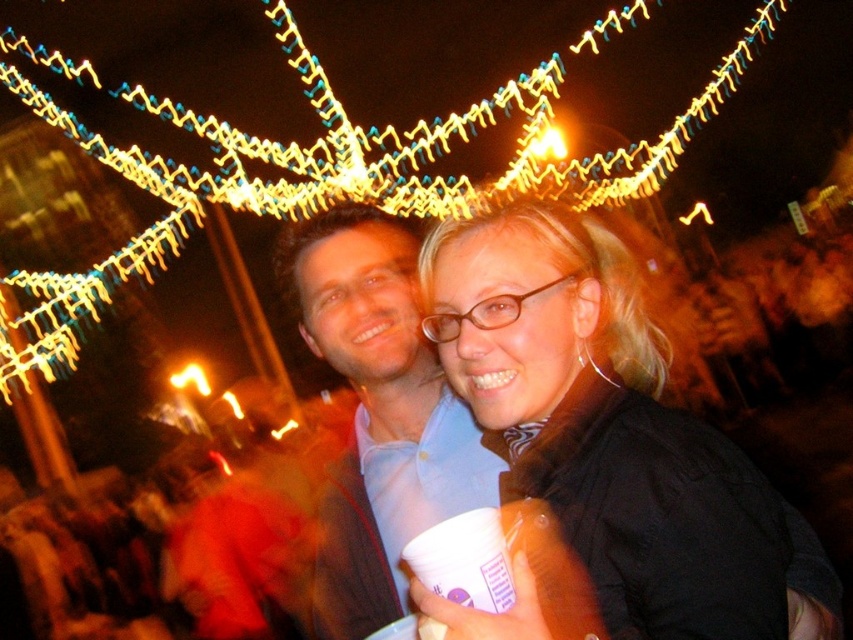
Between black matte jacket at center and yellow string lights at upper center, which one is positioned lower?

Positioned lower is black matte jacket at center.

Who is taller, black matte jacket at center or yellow string lights at upper center?

Standing taller between the two is yellow string lights at upper center.

You are a GUI agent. You are given a task and a screenshot of the screen. Output one action in this format:
    pyautogui.click(x=<x>, y=<y>)
    Task: Click on the black matte jacket at center
    The height and width of the screenshot is (640, 853).
    Given the screenshot: What is the action you would take?
    (606, 428)

This screenshot has width=853, height=640. In order to click on yellow string lights at upper center in this screenshot , I will do `click(331, 176)`.

Can you confirm if yellow string lights at upper center is bigger than matte blue shirt at center?

Yes, yellow string lights at upper center is bigger than matte blue shirt at center.

Between point (160, 182) and point (363, 365), which one is positioned in front?

Point (363, 365) is more forward.

This screenshot has width=853, height=640. Find the location of `yellow string lights at upper center`. yellow string lights at upper center is located at coordinates (331, 176).

From the picture: Who is lower down, black matte jacket at center or matte blue shirt at center?

Positioned lower is matte blue shirt at center.

This screenshot has width=853, height=640. Identify the location of black matte jacket at center. (606, 428).